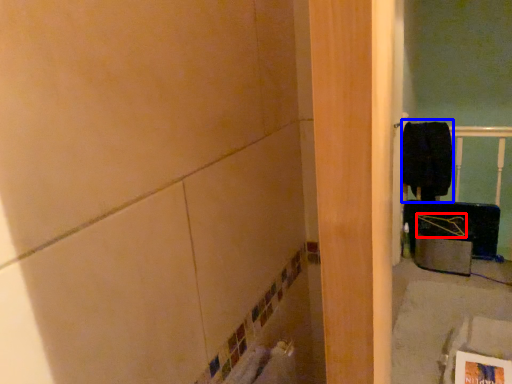
Question: Which object appears farthest to the camera in this image, job (highlighted by a red box) or laundry (highlighted by a blue box)?

Choices:
 (A) job
 (B) laundry

Answer: (B)